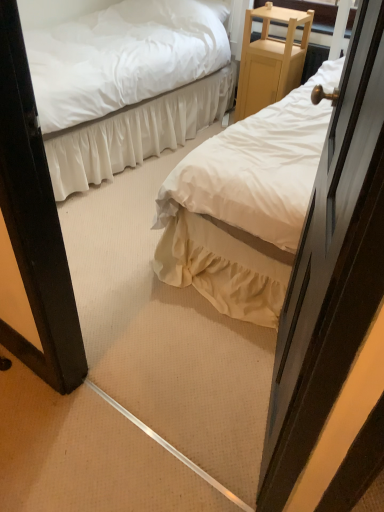
Question: Is white cotton bed at center, which ranks as the 1th bed in right-to-left order, further to the viewer compared to white satin bed at center, arranged as the 1th bed when viewed from the left?

Choices:
 (A) no
 (B) yes

Answer: (A)

Question: Can you confirm if white cotton bed at center, which is the 2th bed in left-to-right order, is wider than white satin bed at center, arranged as the 1th bed when viewed from the left?

Choices:
 (A) no
 (B) yes

Answer: (B)

Question: Is white cotton bed at center, which ranks as the 1th bed in right-to-left order, located outside white satin bed at center, arranged as the 1th bed when viewed from the left?

Choices:
 (A) no
 (B) yes

Answer: (B)

Question: Is white cotton bed at center, which ranks as the 1th bed in right-to-left order, directly adjacent to white satin bed at center, arranged as the 2th bed when viewed from the right?

Choices:
 (A) no
 (B) yes

Answer: (A)

Question: From the image's perspective, is white cotton bed at center, which is the 2th bed in left-to-right order, on top of white satin bed at center, arranged as the 1th bed when viewed from the left?

Choices:
 (A) no
 (B) yes

Answer: (A)

Question: Considering the relative sizes of white cotton bed at center, which ranks as the 1th bed in right-to-left order, and white satin bed at center, arranged as the 2th bed when viewed from the right, in the image provided, is white cotton bed at center, which ranks as the 1th bed in right-to-left order, thinner than white satin bed at center, arranged as the 2th bed when viewed from the right,?

Choices:
 (A) yes
 (B) no

Answer: (B)

Question: Can you confirm if light wood/finely crafted nightstand at upper right is taller than white cotton bed at center, which is the 2th bed in left-to-right order?

Choices:
 (A) no
 (B) yes

Answer: (A)

Question: From a real-world perspective, is light wood/finely crafted nightstand at upper right positioned under white cotton bed at center, which ranks as the 1th bed in right-to-left order, based on gravity?

Choices:
 (A) yes
 (B) no

Answer: (A)

Question: Is light wood/finely crafted nightstand at upper right with white cotton bed at center, which ranks as the 1th bed in right-to-left order?

Choices:
 (A) no
 (B) yes

Answer: (A)

Question: From the image's perspective, would you say light wood/finely crafted nightstand at upper right is positioned over white cotton bed at center, which is the 2th bed in left-to-right order?

Choices:
 (A) no
 (B) yes

Answer: (B)

Question: Is light wood/finely crafted nightstand at upper right thinner than white cotton bed at center, which ranks as the 1th bed in right-to-left order?

Choices:
 (A) no
 (B) yes

Answer: (B)

Question: Could you tell me if light wood/finely crafted nightstand at upper right is facing white cotton bed at center, which ranks as the 1th bed in right-to-left order?

Choices:
 (A) no
 (B) yes

Answer: (A)

Question: From the image's perspective, is wooden door at right on white satin bed at center, arranged as the 1th bed when viewed from the left?

Choices:
 (A) no
 (B) yes

Answer: (A)